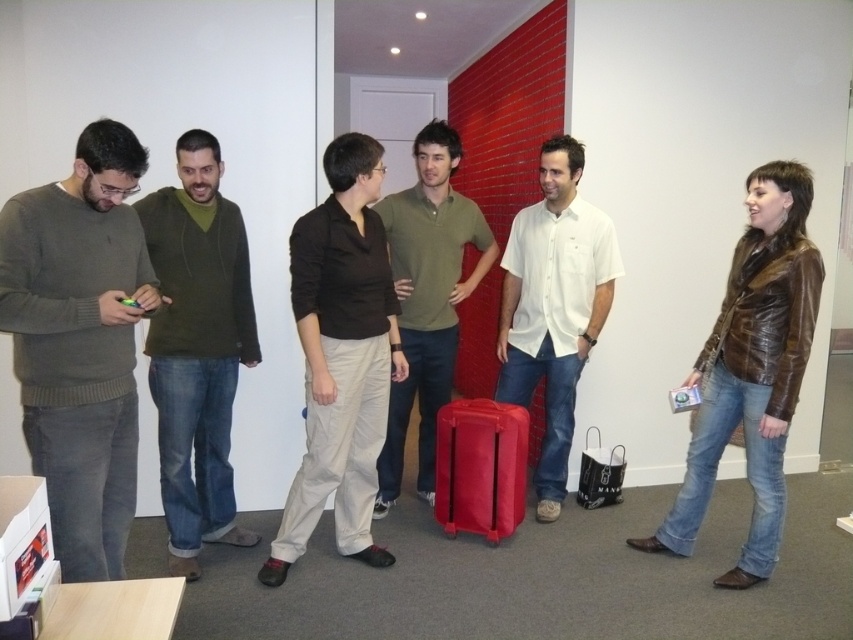
Question: Does green sweater at center appear under brown leather jacket at right?

Choices:
 (A) yes
 (B) no

Answer: (B)

Question: Which point is closer to the camera taking this photo?

Choices:
 (A) (344, 422)
 (B) (122, 243)
 (C) (793, 182)
 (D) (575, 339)

Answer: (B)

Question: Is green sweater at center wider than matte green polo shirt at center?

Choices:
 (A) yes
 (B) no

Answer: (B)

Question: Which point is farther to the camera?

Choices:
 (A) green sweater at center
 (B) white cotton shirt at center

Answer: (B)

Question: Among these points, which one is farthest from the camera?

Choices:
 (A) (421, 140)
 (B) (55, 237)
 (C) (200, 387)
 (D) (486, 419)

Answer: (A)

Question: Where is matte gray sweater at left located in relation to matte green polo shirt at center in the image?

Choices:
 (A) left
 (B) right

Answer: (A)